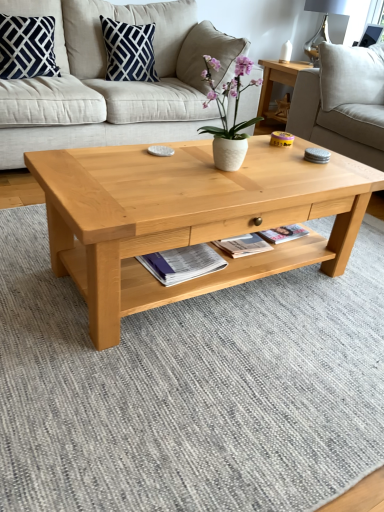
In order to face light brown wood coffee table at center, should I rotate leftwards or rightwards?

Turn right by 2.624 degrees to look at light brown wood coffee table at center.

At what (x,y) coordinates should I click in order to perform the action: click on white ceramic vase at center. Please return your answer as a coordinate pair (x, y). Looking at the image, I should click on (226, 114).

How much space does navy blue cotton pillow at upper left, which is the 1th pillow in left-to-right order, occupy horizontally?

It is 22.11 centimeters.

At what (x,y) coordinates should I click in order to perform the action: click on matte paper magazine at center. Please return your answer as a coordinate pair (x, y). The height and width of the screenshot is (512, 384). Looking at the image, I should click on (182, 263).

Measure the distance between beige fabric couch at center, which ranks as the 1th studio couch in left-to-right order, and camera.

beige fabric couch at center, which ranks as the 1th studio couch in left-to-right order, and camera are 6.93 feet apart from each other.

This screenshot has width=384, height=512. What are the coordinates of `light brown wood coffee table at center` in the screenshot? It's located at (188, 217).

How much distance is there between white ceramic vase at center and matte paper magazine at center?

The distance of white ceramic vase at center from matte paper magazine at center is 21.46 inches.

From a real-world perspective, between white ceramic vase at center and matte paper magazine at center, who is vertically lower?

From a 3D spatial view, matte paper magazine at center is below.

Is white ceramic vase at center not close to matte paper magazine at center?

They are positioned close to each other.

The height and width of the screenshot is (512, 384). What are the coordinates of `magazine below the white ceramic vase at center (from a real-world perspective)` in the screenshot? It's located at (182, 263).

Is matte paper magazine at center to the left or to the right of metallic silver lamp at upper right in the image?

matte paper magazine at center is positioned on metallic silver lamp at upper right's left side.

This screenshot has width=384, height=512. Identify the location of lamp on the right of matte paper magazine at center. (322, 24).

Does matte paper magazine at center come in front of metallic silver lamp at upper right?

Yes, it is.

From the image's perspective, which is below, navy blue cotton pillow at upper center, the 1th pillow positioned from the right, or metallic silver lamp at upper right?

navy blue cotton pillow at upper center, the 1th pillow positioned from the right, appears lower in the image.

How many degrees apart are the facing directions of navy blue cotton pillow at upper center, which is the second pillow in left-to-right order, and metallic silver lamp at upper right?

46.6 degrees.

Considering the relative sizes of navy blue cotton pillow at upper center, the 1th pillow positioned from the right, and metallic silver lamp at upper right in the image provided, is navy blue cotton pillow at upper center, the 1th pillow positioned from the right, thinner than metallic silver lamp at upper right?

Yes, navy blue cotton pillow at upper center, the 1th pillow positioned from the right, is thinner than metallic silver lamp at upper right.

Is light brown wood coffee table at center oriented away from matte paper magazine at center?

Correct, light brown wood coffee table at center is looking away from matte paper magazine at center.

Can you confirm if light brown wood coffee table at center is taller than matte paper magazine at center?

Correct, light brown wood coffee table at center is much taller as matte paper magazine at center.

Would you consider white ceramic vase at center to be distant from metallic silver lamp at upper right?

white ceramic vase at center is positioned a significant distance from metallic silver lamp at upper right.

From a real-world perspective, is white ceramic vase at center physically below metallic silver lamp at upper right?

Yes, from a real-world perspective, white ceramic vase at center is under metallic silver lamp at upper right.

From the image's perspective, is white ceramic vase at center beneath metallic silver lamp at upper right?

Indeed, from the image's perspective, white ceramic vase at center is shown beneath metallic silver lamp at upper right.

Locate an element on the screen. the 1st pillow above the light brown wood coffee table at center (from the image's perspective) is located at coordinates click(27, 47).

Can you confirm if navy blue cotton pillow at upper left, which is the 1th pillow in left-to-right order, is thinner than light brown wood coffee table at center?

Yes, navy blue cotton pillow at upper left, which is the 1th pillow in left-to-right order, is thinner than light brown wood coffee table at center.

Between navy blue cotton pillow at upper left, which is the 1th pillow in left-to-right order, and light brown wood coffee table at center, which one appears on the right side from the viewer's perspective?

light brown wood coffee table at center is more to the right.

Would you say navy blue cotton pillow at upper left, which is the 1th pillow in left-to-right order, is outside light brown wood coffee table at center?

Yes, navy blue cotton pillow at upper left, which is the 1th pillow in left-to-right order, is located beyond the bounds of light brown wood coffee table at center.

In the scene shown: Would you consider beige fabric couch at center, arranged as the second studio couch when viewed from the right, to be distant from white ceramic vase at center?

Actually, beige fabric couch at center, arranged as the second studio couch when viewed from the right, and white ceramic vase at center are a little close together.

Considering the relative sizes of beige fabric couch at center, which ranks as the 1th studio couch in left-to-right order, and white ceramic vase at center in the image provided, is beige fabric couch at center, which ranks as the 1th studio couch in left-to-right order, thinner than white ceramic vase at center?

No.

Which is nearer, (x=24, y=94) or (x=230, y=82)?

Point (x=24, y=94) is farther from the camera than point (x=230, y=82).

Is white ceramic vase at center surrounded by beige fabric couch at center, which ranks as the 1th studio couch in left-to-right order?

No, white ceramic vase at center is not inside beige fabric couch at center, which ranks as the 1th studio couch in left-to-right order.

Where is `magazine beneath the white ceramic vase at center (from a real-world perspective)`? magazine beneath the white ceramic vase at center (from a real-world perspective) is located at coordinates (182, 263).

Locate an element on the screen. Image resolution: width=384 pixels, height=512 pixels. lamp on the right of matte paper magazine at center is located at coordinates (322, 24).

Based on their spatial positions, is beige fabric couch at center, arranged as the second studio couch when viewed from the right, or navy blue cotton pillow at upper left, the second pillow when ordered from right to left, closer to matte paper magazine at center?

beige fabric couch at center, arranged as the second studio couch when viewed from the right, lies closer to matte paper magazine at center than the other object.

Estimate the real-world distances between objects in this image. Which object is closer to navy blue cotton pillow at upper center, which is the second pillow in left-to-right order, white ceramic vase at center or metallic silver lamp at upper right?

white ceramic vase at center lies closer to navy blue cotton pillow at upper center, which is the second pillow in left-to-right order, than the other object.

Based on their spatial positions, is navy blue cotton pillow at upper center, which is the second pillow in left-to-right order, or white ceramic vase at center closer to matte paper magazine at center?

The object closer to matte paper magazine at center is white ceramic vase at center.

Based on their spatial positions, is matte paper magazine at center or light beige fabric studio couch at upper right, the first studio couch when ordered from right to left, further from navy blue cotton pillow at upper center, which is the second pillow in left-to-right order?

matte paper magazine at center lies further to navy blue cotton pillow at upper center, which is the second pillow in left-to-right order, than the other object.

Based on their spatial positions, is light beige fabric studio couch at upper right, positioned as the 2th studio couch in left-to-right order, or beige fabric couch at center, which ranks as the 1th studio couch in left-to-right order, further from white ceramic vase at center?

Among the two, light beige fabric studio couch at upper right, positioned as the 2th studio couch in left-to-right order, is located further to white ceramic vase at center.

From the image, which object appears to be farther from metallic silver lamp at upper right, light brown wood coffee table at center or white ceramic vase at center?

Based on the image, light brown wood coffee table at center appears to be further to metallic silver lamp at upper right.

Based on their spatial positions, is white ceramic vase at center or light beige fabric studio couch at upper right, positioned as the 2th studio couch in left-to-right order, closer to metallic silver lamp at upper right?

light beige fabric studio couch at upper right, positioned as the 2th studio couch in left-to-right order, is positioned closer to the anchor metallic silver lamp at upper right.

Which object lies further to the anchor point light brown wood coffee table at center, matte paper magazine at center or navy blue cotton pillow at upper left, the second pillow when ordered from right to left?

navy blue cotton pillow at upper left, the second pillow when ordered from right to left.

Locate an element on the screen. The width and height of the screenshot is (384, 512). houseplant between beige fabric couch at center, which ranks as the 1th studio couch in left-to-right order, and light beige fabric studio couch at upper right, positioned as the 2th studio couch in left-to-right order, in the horizontal direction is located at coordinates (226, 114).

Find the location of `magazine between navy blue cotton pillow at upper left, the second pillow when ordered from right to left, and light beige fabric studio couch at upper right, positioned as the 2th studio couch in left-to-right order, from left to right`. magazine between navy blue cotton pillow at upper left, the second pillow when ordered from right to left, and light beige fabric studio couch at upper right, positioned as the 2th studio couch in left-to-right order, from left to right is located at coordinates (182, 263).

The width and height of the screenshot is (384, 512). I want to click on houseplant that lies between navy blue cotton pillow at upper left, which is the 1th pillow in left-to-right order, and matte paper magazine at center from top to bottom, so 226,114.

Identify the location of pillow situated between beige fabric couch at center, arranged as the second studio couch when viewed from the right, and light beige fabric studio couch at upper right, the first studio couch when ordered from right to left, from left to right. Image resolution: width=384 pixels, height=512 pixels. (129, 51).